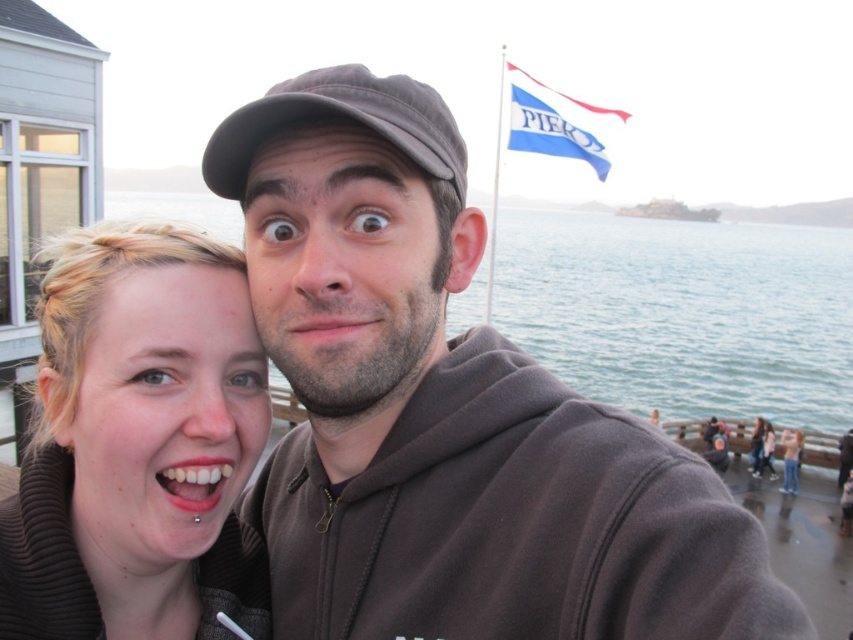
Does matte brown hair at center have a larger size compared to brown matte hoodie at center?

Correct, matte brown hair at center is larger in size than brown matte hoodie at center.

I want to click on matte brown hair at center, so 138,444.

This screenshot has height=640, width=853. Find the location of `matte brown hair at center`. matte brown hair at center is located at coordinates (138, 444).

Based on the photo, who is more distant from viewer, [90,289] or [630,326]?

Point [630,326]

The width and height of the screenshot is (853, 640). What do you see at coordinates (138, 444) in the screenshot? I see `matte brown hair at center` at bounding box center [138, 444].

Where is `matte brown hair at center`? This screenshot has height=640, width=853. matte brown hair at center is located at coordinates (138, 444).

Can you confirm if clear blue water at center is shorter than brown matte hoodie at center?

No.

Who is taller, clear blue water at center or brown matte hoodie at center?

clear blue water at center

Identify the location of clear blue water at center. The width and height of the screenshot is (853, 640). (683, 314).